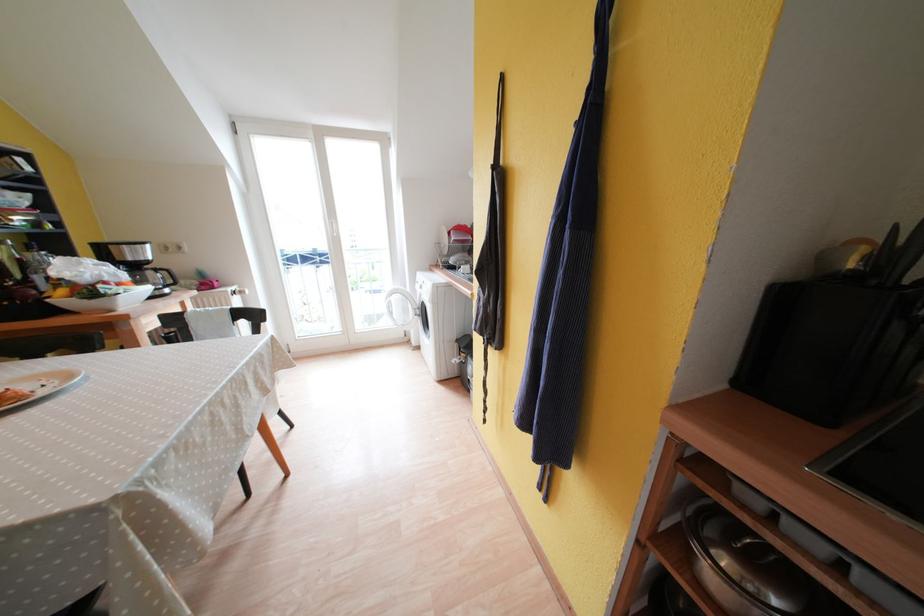
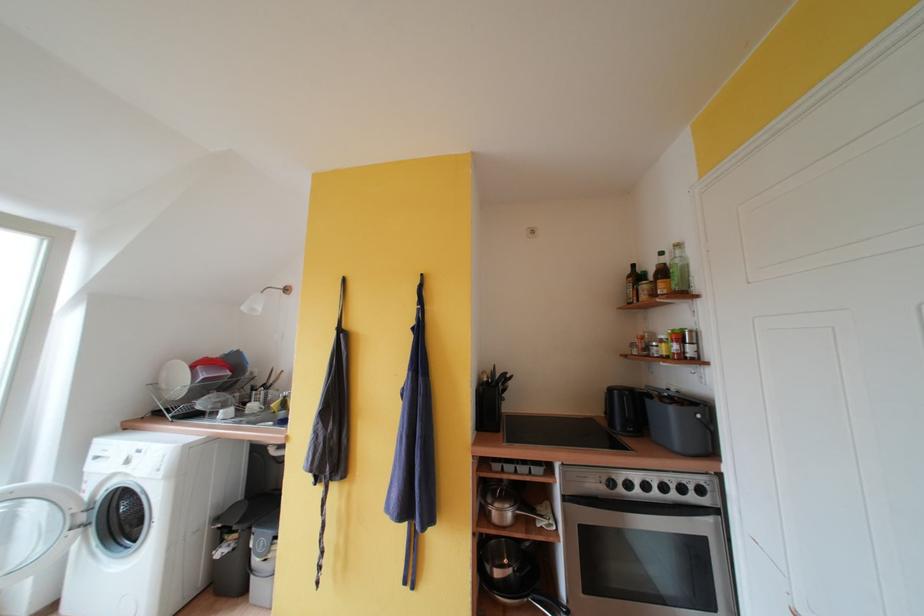
Locate, in the second image, the point that corresponds to (715,533) in the first image.

(495, 504)